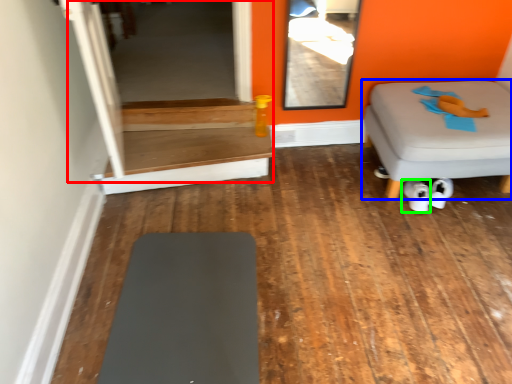
Question: Estimate the real-world distances between objects in this image. Which object is closer to glass door (highlighted by a red box), furniture (highlighted by a blue box) or footwear (highlighted by a green box)?

Choices:
 (A) furniture
 (B) footwear

Answer: (A)